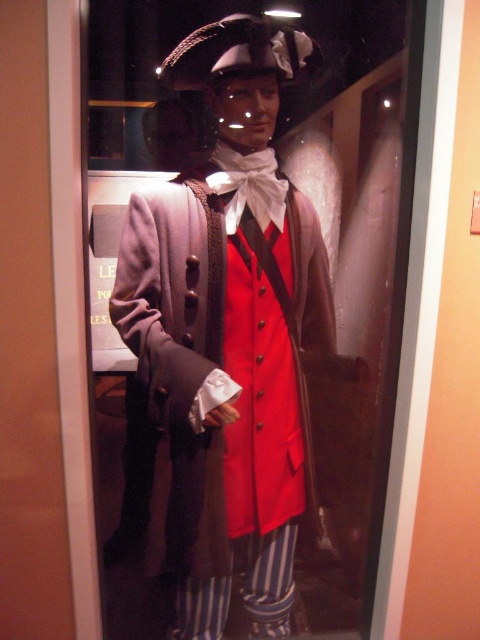
Question: From the image, what is the correct spatial relationship of matte brown coat at center in relation to white satin tie at center?

Choices:
 (A) above
 (B) below

Answer: (B)

Question: Which of the following is the farthest from the observer?

Choices:
 (A) (255, 208)
 (B) (151, 397)

Answer: (A)

Question: Which point is closer to the camera?

Choices:
 (A) (243, 452)
 (B) (266, 168)

Answer: (B)

Question: Can you confirm if matte brown coat at center is thinner than white satin tie at center?

Choices:
 (A) no
 (B) yes

Answer: (A)

Question: Is matte brown coat at center to the left of white satin tie at center from the viewer's perspective?

Choices:
 (A) no
 (B) yes

Answer: (B)